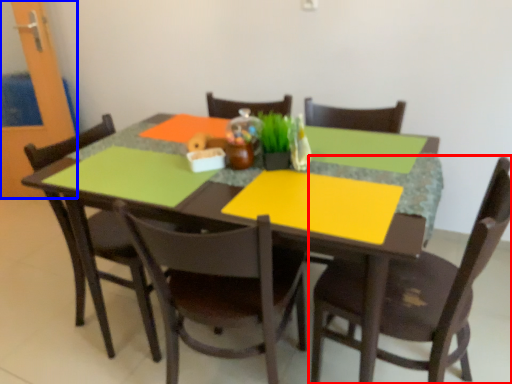
Question: Which object appears closest to the camera in this image, chair (highlighted by a red box) or glass door (highlighted by a blue box)?

Choices:
 (A) chair
 (B) glass door

Answer: (A)